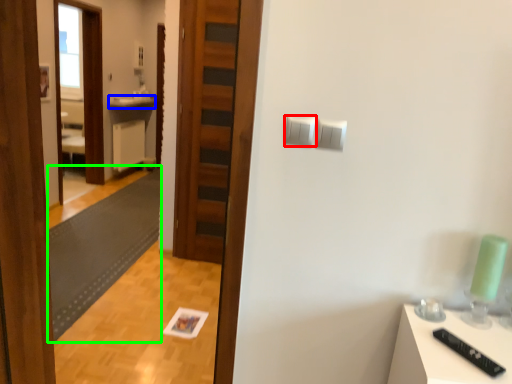
Question: Which object is the closest to the light switch (highlighted by a red box)? Choose among these: counter top (highlighted by a blue box) or mat (highlighted by a green box).

Choices:
 (A) counter top
 (B) mat

Answer: (B)